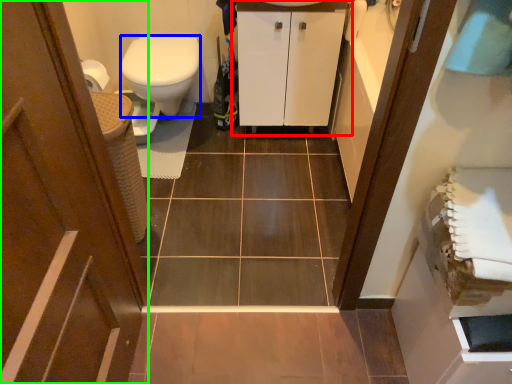
Question: Based on their relative distances, which object is farther from bathroom cabinet (highlighted by a red box)? Choose from bidet (highlighted by a blue box) and door (highlighted by a green box).

Choices:
 (A) bidet
 (B) door

Answer: (B)